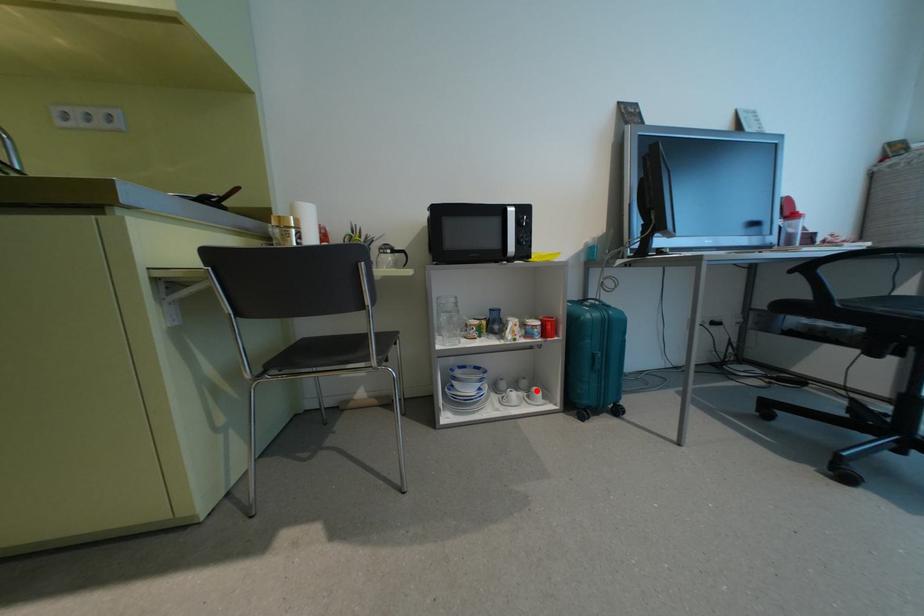
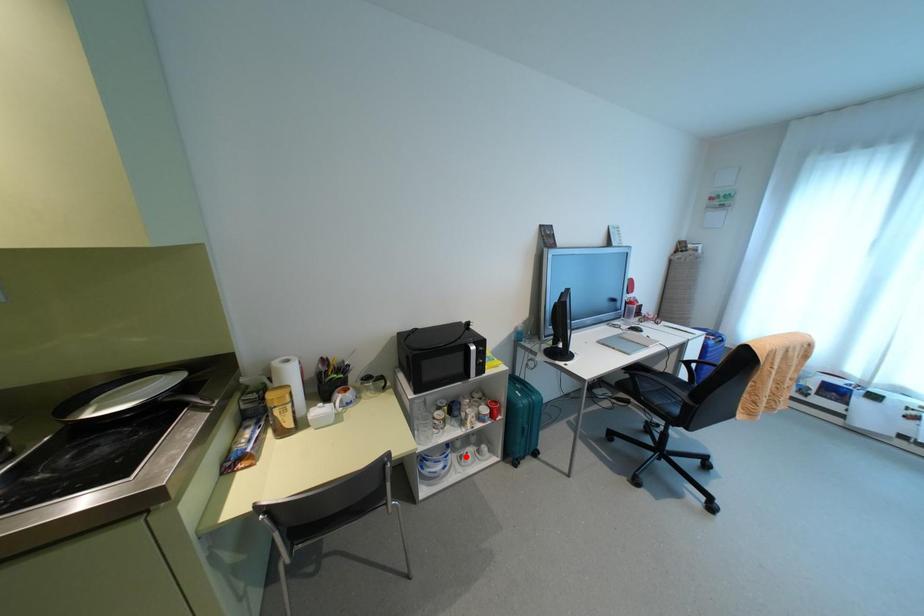
I am providing you with two images of the same scene from different viewpoints. A red point is marked on the first image and another point is marked on the second image. Is the marked point in image1 the same physical position as the marked point in image2?

No